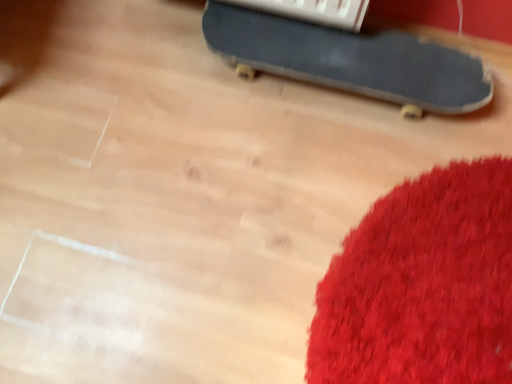
What do you see at coordinates (348, 59) in the screenshot? This screenshot has height=384, width=512. I see `smooth black skateboard at upper right` at bounding box center [348, 59].

Identify the location of smooth black skateboard at upper right. (348, 59).

Identify the location of smooth black skateboard at upper right. (348, 59).